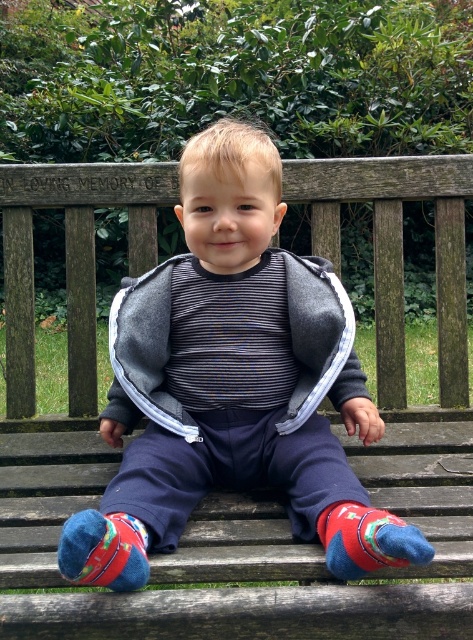
You are a photographer trying to capture the child in the image. You want to ensure both the red matte sock at lower right and the multicolored felt sock at lower left are clearly visible in the frame. Given their positions, which sock might be more challenging to fully capture in the photo?

The multicolored felt sock at lower left is taller than the red matte sock at lower right, so it might be more challenging to fully capture in the photo because its height could cause it to extend beyond the frame if not positioned carefully.

You are a photographer trying to focus on the matte gray vest at center and the multicolored felt sock at lower left. Which object should you adjust your camera focus on first to ensure both are in focus?

The matte gray vest at center is in front of the multicolored felt sock at lower left, so you should focus on the matte gray vest at center first to ensure both are in focus.